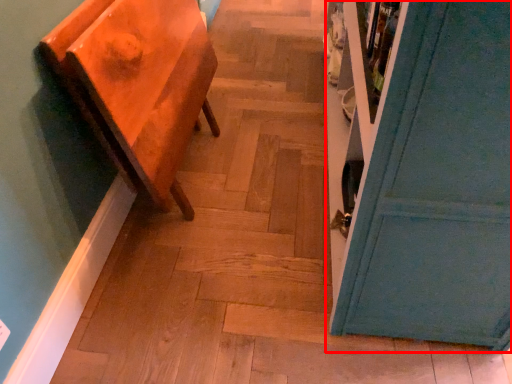
Question: From the image's perspective, where is door (annotated by the red box) located in relation to furniture in the image?

Choices:
 (A) above
 (B) below

Answer: (A)